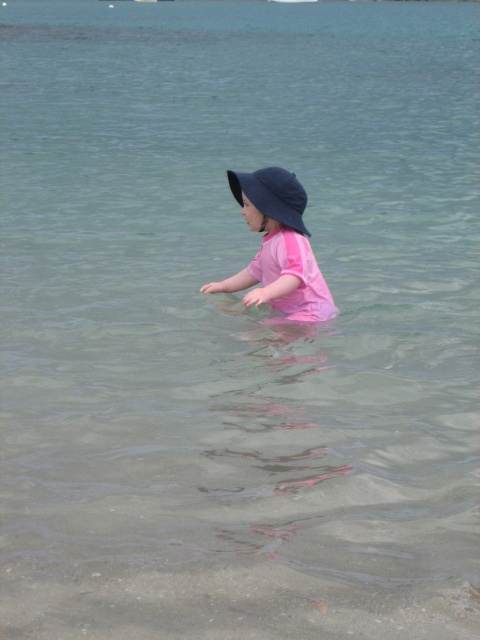
Does pink matte swimsuit at center appear over dark blue fabric hat at center?

No.

Is point (292, 198) less distant than point (282, 211)?

No, it is not.

Between point (271, 224) and point (262, 211), which one is positioned in front?

Point (262, 211) is more forward.

You are a GUI agent. You are given a task and a screenshot of the screen. Output one action in this format:
    pyautogui.click(x=<x>, y=<y>)
    Task: Click on the pink matte swimsuit at center
    The width and height of the screenshot is (480, 640).
    Given the screenshot: What is the action you would take?
    pyautogui.click(x=277, y=248)